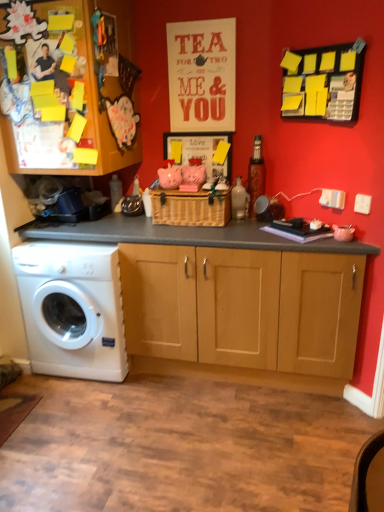
Question: From the image's perspective, does wooden cabinet at center appear lower than yellow sticky notes at upper right?

Choices:
 (A) no
 (B) yes

Answer: (A)

Question: Is wooden cabinet at center taller than yellow sticky notes at upper right?

Choices:
 (A) no
 (B) yes

Answer: (B)

Question: Could yellow sticky notes at upper right be considered to be inside wooden cabinet at center?

Choices:
 (A) no
 (B) yes

Answer: (A)

Question: Is wooden cabinet at center far from yellow sticky notes at upper right?

Choices:
 (A) no
 (B) yes

Answer: (B)

Question: From a real-world perspective, is wooden cabinet at center located beneath yellow sticky notes at upper right?

Choices:
 (A) yes
 (B) no

Answer: (B)

Question: Considering the relative sizes of wooden cabinet at center and yellow sticky notes at upper right in the image provided, is wooden cabinet at center thinner than yellow sticky notes at upper right?

Choices:
 (A) yes
 (B) no

Answer: (B)

Question: Considering the relative sizes of yellow sticky notes at upper right and white plastic washing machine at lower left in the image provided, is yellow sticky notes at upper right bigger than white plastic washing machine at lower left?

Choices:
 (A) yes
 (B) no

Answer: (B)

Question: From the image's perspective, does yellow sticky notes at upper right appear higher than white plastic washing machine at lower left?

Choices:
 (A) no
 (B) yes

Answer: (B)

Question: Is yellow sticky notes at upper right in contact with white plastic washing machine at lower left?

Choices:
 (A) no
 (B) yes

Answer: (A)

Question: Is yellow sticky notes at upper right facing away from white plastic washing machine at lower left?

Choices:
 (A) no
 (B) yes

Answer: (A)

Question: Can you confirm if yellow sticky notes at upper right is taller than white plastic washing machine at lower left?

Choices:
 (A) no
 (B) yes

Answer: (A)

Question: Can you confirm if yellow sticky notes at upper right is smaller than white plastic washing machine at lower left?

Choices:
 (A) no
 (B) yes

Answer: (B)

Question: Is white plastic washing machine at lower left wider than woven brown basket at center?

Choices:
 (A) yes
 (B) no

Answer: (A)